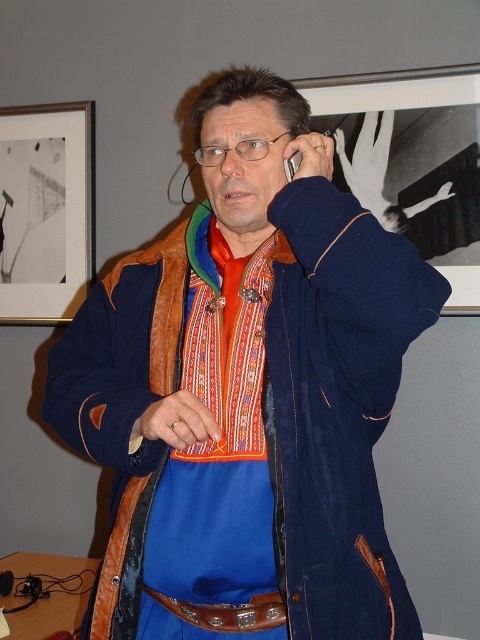
Can you confirm if matte leather jacket at center is positioned to the left of embroidered fabric apron at center?

Incorrect, matte leather jacket at center is not on the left side of embroidered fabric apron at center.

From the picture: Is matte leather jacket at center positioned at the back of embroidered fabric apron at center?

No, it is in front of embroidered fabric apron at center.

Locate an element on the screen. The image size is (480, 640). matte leather jacket at center is located at coordinates (248, 388).

Identify the location of matte leather jacket at center. The image size is (480, 640). (248, 388).

Between point (242, 566) and point (408, 205), which one is positioned in front?

Point (242, 566)

In the scene shown: Between embroidered fabric apron at center and matte black frame at upper center, which one is positioned lower?

Positioned lower is embroidered fabric apron at center.

The height and width of the screenshot is (640, 480). Find the location of `embroidered fabric apron at center`. embroidered fabric apron at center is located at coordinates (216, 464).

Can you confirm if matte black frame at upper center is taller than brown leather belt at center?

Yes, matte black frame at upper center is taller than brown leather belt at center.

Can you confirm if matte black frame at upper center is positioned to the right of brown leather belt at center?

Yes, matte black frame at upper center is to the right of brown leather belt at center.

Does point (372, 144) come in front of point (215, 611)?

That is False.

Where is `matte black frame at upper center`? The height and width of the screenshot is (640, 480). matte black frame at upper center is located at coordinates (412, 161).